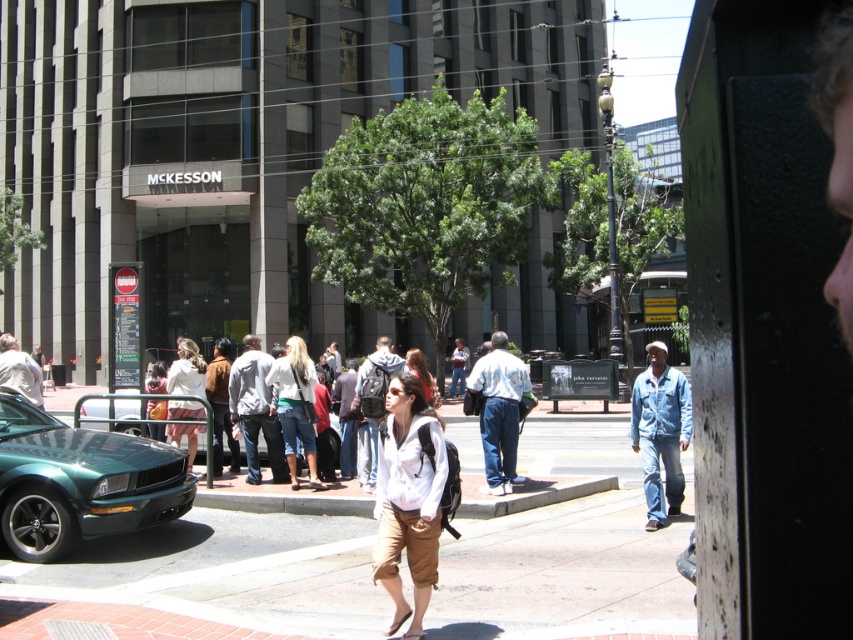
What do you see at coordinates (19, 369) in the screenshot? The image size is (853, 640). I see `light brown leather jacket at center` at bounding box center [19, 369].

The width and height of the screenshot is (853, 640). What do you see at coordinates (19, 369) in the screenshot?
I see `light brown leather jacket at center` at bounding box center [19, 369].

You are a GUI agent. You are given a task and a screenshot of the screen. Output one action in this format:
    pyautogui.click(x=<x>, y=<y>)
    Task: Click on the light brown leather jacket at center
    
    Given the screenshot: What is the action you would take?
    pyautogui.click(x=19, y=369)

Is khaki cotton shorts at center taller than brown leather jacket at center?

In fact, khaki cotton shorts at center may be shorter than brown leather jacket at center.

In the scene shown: Which of these two, khaki cotton shorts at center or brown leather jacket at center, stands taller?

Standing taller between the two is brown leather jacket at center.

Image resolution: width=853 pixels, height=640 pixels. I want to click on khaki cotton shorts at center, so click(408, 500).

Where is `khaki cotton shorts at center`? This screenshot has height=640, width=853. khaki cotton shorts at center is located at coordinates (408, 500).

Can you confirm if brown leather jacket at center is wider than matte white shirt at center?

Indeed, brown leather jacket at center has a greater width compared to matte white shirt at center.

Between point (209, 378) and point (431, 392), which one is positioned in front?

Point (431, 392)

At what (x,y) coordinates should I click in order to perform the action: click on brown leather jacket at center. Please return your answer as a coordinate pair (x, y). Looking at the image, I should click on (219, 406).